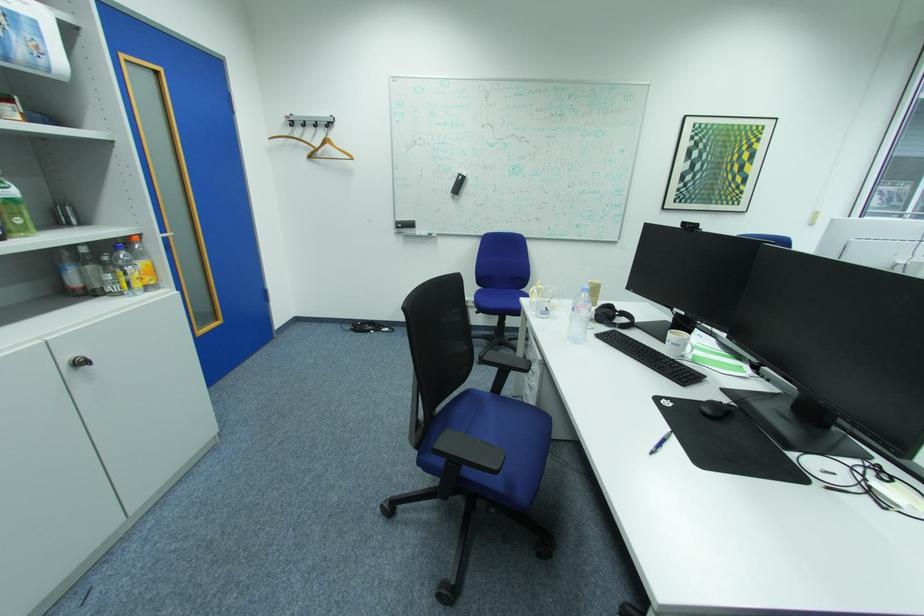
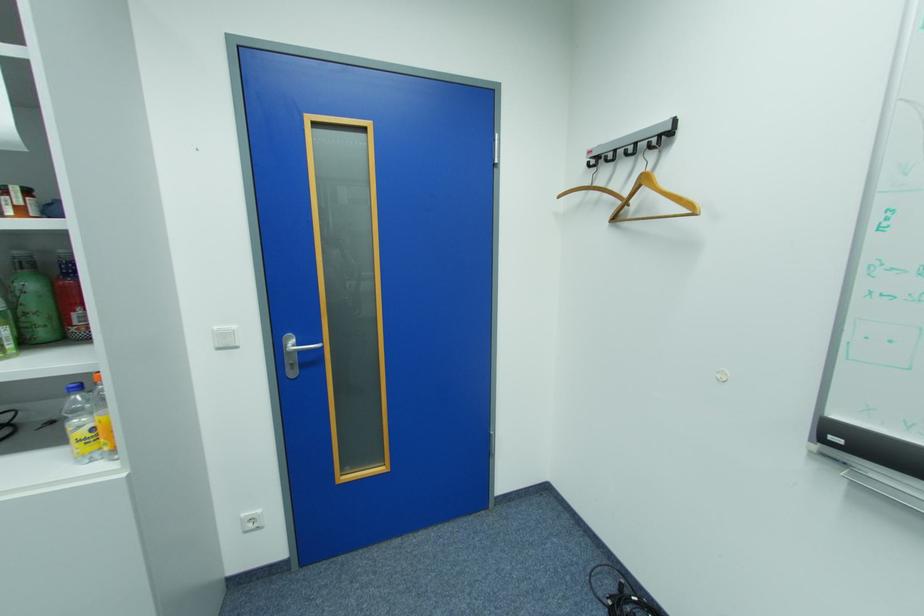
In the second image, find the point that corresponds to pixel 407 225 in the first image.

(845, 440)